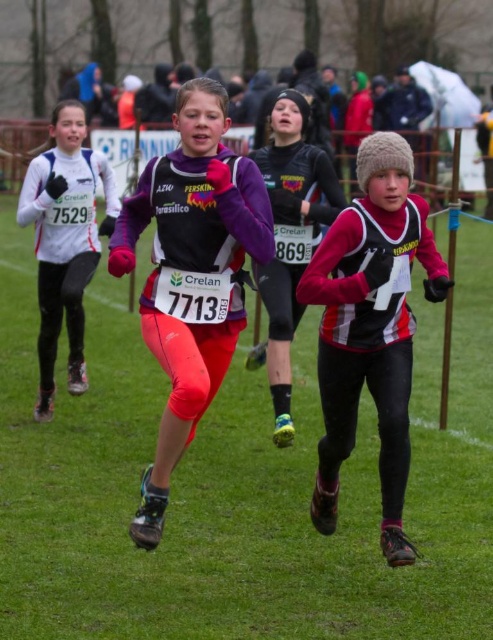
Between purple matte running suit at center and matte purple jacket at center, which one is positioned higher?

matte purple jacket at center is higher up.

Can you confirm if purple matte running suit at center is thinner than matte purple jacket at center?

In fact, purple matte running suit at center might be wider than matte purple jacket at center.

From the picture: Who is more forward, [241,292] or [282,314]?

Positioned in front is point [241,292].

The height and width of the screenshot is (640, 493). What are the coordinates of `purple matte running suit at center` in the screenshot? It's located at (190, 273).

Consider the image. Does matte red and black running suit at center have a lesser width compared to white matte running suit at left?

Incorrect, matte red and black running suit at center's width is not less than white matte running suit at left's.

Does matte red and black running suit at center appear on the left side of white matte running suit at left?

Incorrect, matte red and black running suit at center is not on the left side of white matte running suit at left.

Does point (385, 468) lie in front of point (90, 228)?

Yes, it is in front of point (90, 228).

The image size is (493, 640). What are the coordinates of `matte red and black running suit at center` in the screenshot? It's located at (371, 326).

Which is above, white matte running suit at left or matte purple jacket at center?

Positioned higher is white matte running suit at left.

Is white matte running suit at left further to camera compared to matte purple jacket at center?

Yes, white matte running suit at left is behind matte purple jacket at center.

The width and height of the screenshot is (493, 640). What do you see at coordinates (65, 241) in the screenshot?
I see `white matte running suit at left` at bounding box center [65, 241].

Locate an element on the screen. The width and height of the screenshot is (493, 640). white matte running suit at left is located at coordinates (65, 241).